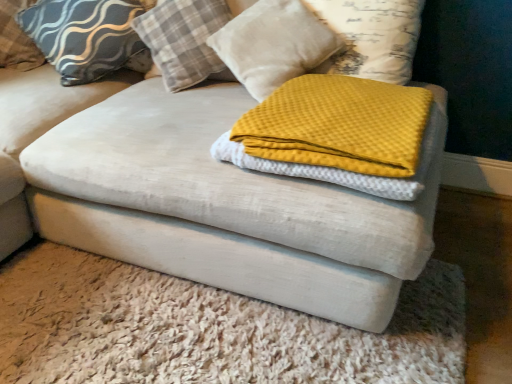
Question: From a real-world perspective, is velvet ottoman at center physically located above or below plaid fabric pillow at upper center, marked as the 2th pillow in a right-to-left arrangement?

Choices:
 (A) below
 (B) above

Answer: (A)

Question: Do you think velvet ottoman at center is within plaid fabric pillow at upper center, the third pillow viewed from the left, or outside of it?

Choices:
 (A) outside
 (B) inside

Answer: (A)

Question: Based on their relative distances, which object is farther from the matte gray pillow at upper left, the second pillow in the left-to-right sequence?

Choices:
 (A) velvet ottoman at center
 (B) textured gray pillow at upper left, which appears as the 4th pillow when viewed from the right
 (C) yellow waffle knit blanket at center
 (D) waffle-textured yellow blanket at center, which is counted as the fourth pillow, starting from the left
 (E) plaid fabric pillow at upper center, the third pillow viewed from the left

Answer: (A)

Question: Which is nearer to the velvet ottoman at center?

Choices:
 (A) yellow waffle knit blanket at center
 (B) textured gray pillow at upper left, which appears as the 4th pillow when viewed from the right
 (C) matte gray pillow at upper left, the second pillow in the left-to-right sequence
 (D) plaid fabric pillow at upper center, the third pillow viewed from the left
 (E) waffle-textured yellow blanket at center, the 1th pillow when ordered from right to left

Answer: (A)